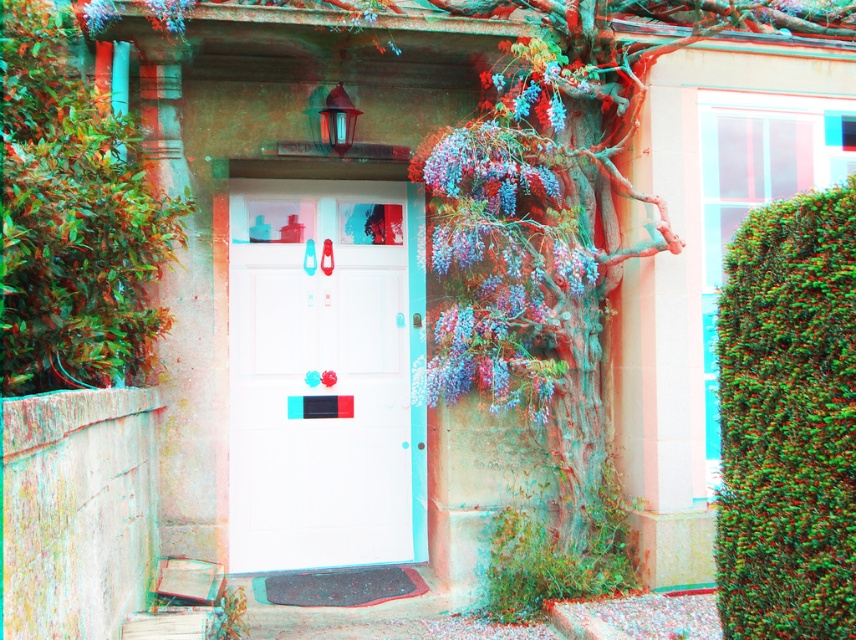
Can you confirm if white glossy door at center is positioned above green leafy bush at left?

No.

At what (x,y) coordinates should I click in order to perform the action: click on white glossy door at center. Please return your answer as a coordinate pair (x, y). Looking at the image, I should click on (322, 371).

This screenshot has width=856, height=640. What are the coordinates of `white glossy door at center` in the screenshot? It's located at (322, 371).

Does green textured hedge at right have a greater width compared to green leafy bush at left?

Incorrect, green textured hedge at right's width does not surpass green leafy bush at left's.

Is point (749, 477) in front of point (58, 99)?

Yes.

Where is `green textured hedge at right`? green textured hedge at right is located at coordinates (788, 420).

Consider the image. Who is taller, white glossy door at center or green textured hedge at right?

With more height is white glossy door at center.

Which is more to the right, white glossy door at center or green textured hedge at right?

From the viewer's perspective, green textured hedge at right appears more on the right side.

Locate an element on the screen. The width and height of the screenshot is (856, 640). white glossy door at center is located at coordinates (322, 371).